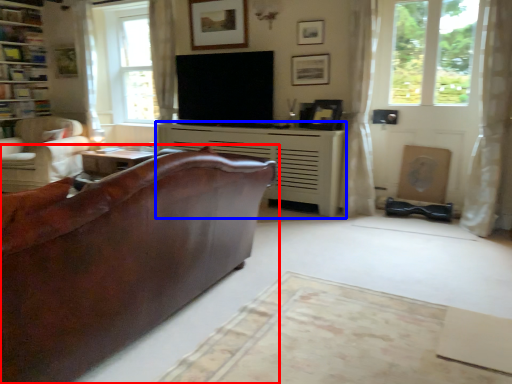
Question: Which point is further to the camera, studio couch (highlighted by a red box) or fireplace (highlighted by a blue box)?

Choices:
 (A) studio couch
 (B) fireplace

Answer: (B)